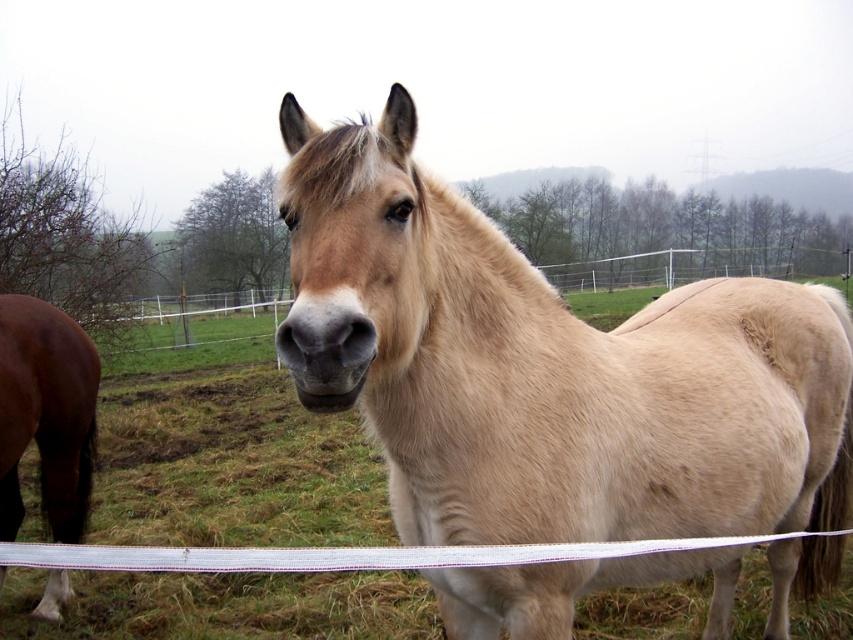
You are a photographer trying to capture the light brown horse at center in the image. The camera you are using has a rectangular viewfinder with a 0.5x magnification. To ensure the horse is centered in your shot, where should you position the camera relative to the point marked at coordinates point [548,369]?

The point [548,369] marks the light brown horse at center, so you should align the camera directly over this point to center the horse in the viewfinder.

You are a photographer trying to capture the light brown horse at center in your shot. The fence is at the bottom of the image. Where should you position the horse relative to the fence to include both in the frame?

The light brown horse at center is located at point (548, 369), which is above the fence at the bottom of the image. Position the horse so it is above the fence to include both in the frame.